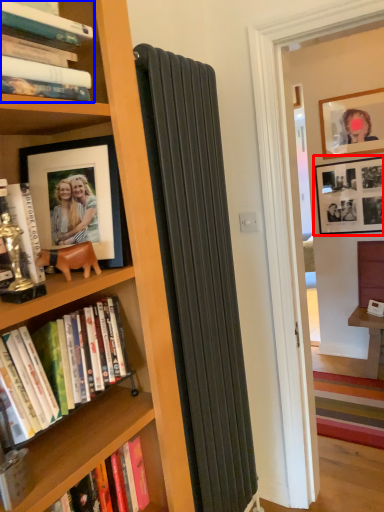
Question: Which of the following is the farthest to the observer, picture frame (highlighted by a red box) or book (highlighted by a blue box)?

Choices:
 (A) picture frame
 (B) book

Answer: (A)